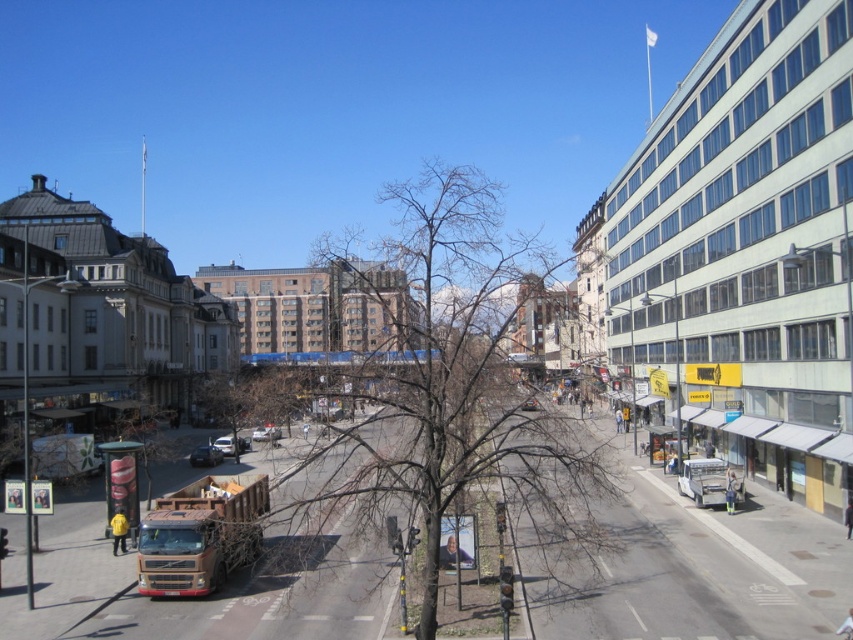
Question: Which of these objects is positioned farthest from the metallic silver car at center?

Choices:
 (A) metallic silver truck at center-left
 (B) brown metallic truck at lower left

Answer: (B)

Question: Is metallic silver car at lower left further to camera compared to metallic silver car at center?

Choices:
 (A) yes
 (B) no

Answer: (B)

Question: Is bare branches at center bigger than metallic silver car at center?

Choices:
 (A) no
 (B) yes

Answer: (B)

Question: Which point is farther to the camera?

Choices:
 (A) (254, 428)
 (B) (431, 593)
 (C) (207, 477)
 (D) (234, 440)

Answer: (A)

Question: Can you confirm if metallic silver truck at center-left is thinner than metallic silver car at center?

Choices:
 (A) yes
 (B) no

Answer: (B)

Question: Which object is closer to the camera taking this photo?

Choices:
 (A) bare branches at center
 (B) metallic silver truck at center-left
 (C) metallic silver car at center
 (D) brown metallic truck at lower left

Answer: (A)